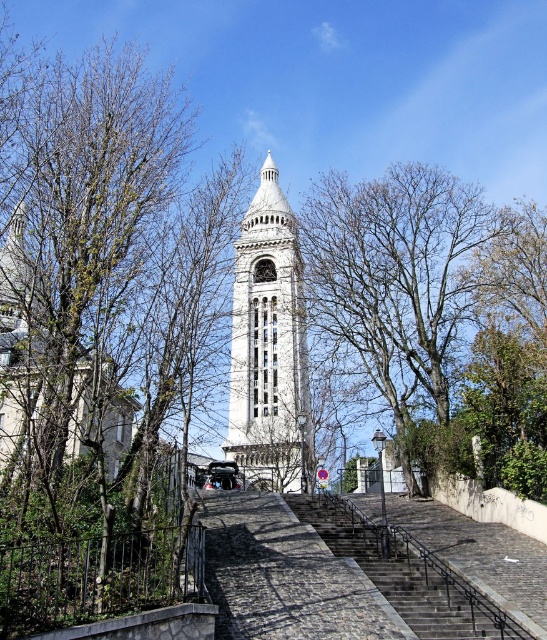
You are standing at the base of the tower and notice both the bare branches at center and the dark gray stone stairs at center. Which object is taller from your perspective?

The bare branches at center is taller than the dark gray stone stairs at center.

You are standing at the base of the tower and want to reach the entrance located at point (240,376). There is an obstacle at point (359,561). Will you have to go around the obstacle to reach your destination?

Yes, you will have to go around the obstacle at point (359,561) because point (240,376) is behind it, meaning the obstacle is blocking the direct path to the destination.